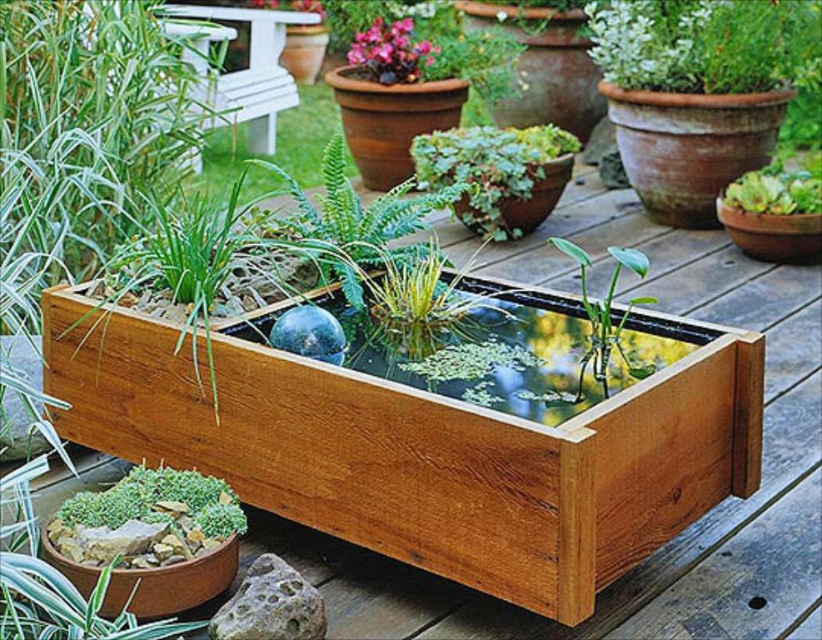
Question: Can you confirm if wooden fish pond at center is smaller than green glossy leafy plant at center?

Choices:
 (A) yes
 (B) no

Answer: (B)

Question: Which of these objects is positioned farthest from the green succulent at lower left?

Choices:
 (A) wooden fish pond at center
 (B) gray porous rock at lower center

Answer: (A)

Question: Is wooden fish pond at center above green succulent at lower left?

Choices:
 (A) no
 (B) yes

Answer: (B)

Question: Does green succulent at lower left have a larger size compared to green glossy leafy plant at center?

Choices:
 (A) no
 (B) yes

Answer: (A)

Question: Which point is closer to the camera taking this photo?

Choices:
 (A) 506,317
 (B) 462,166
 (C) 621,323

Answer: (C)

Question: Which of the following is the closest to the observer?

Choices:
 (A) green glossy leafy plant at center
 (B) wooden fish pond at center

Answer: (B)